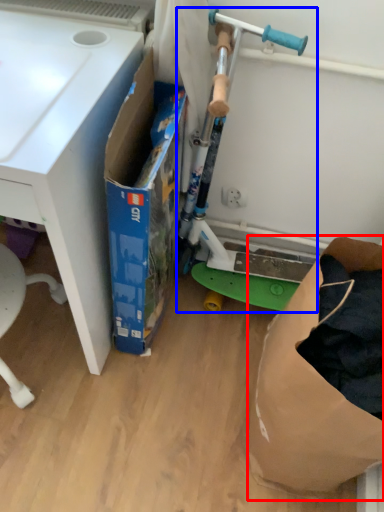
Question: Among these objects, which one is nearest to the camera, paper bag (highlighted by a red box) or appliance (highlighted by a blue box)?

Choices:
 (A) paper bag
 (B) appliance

Answer: (A)